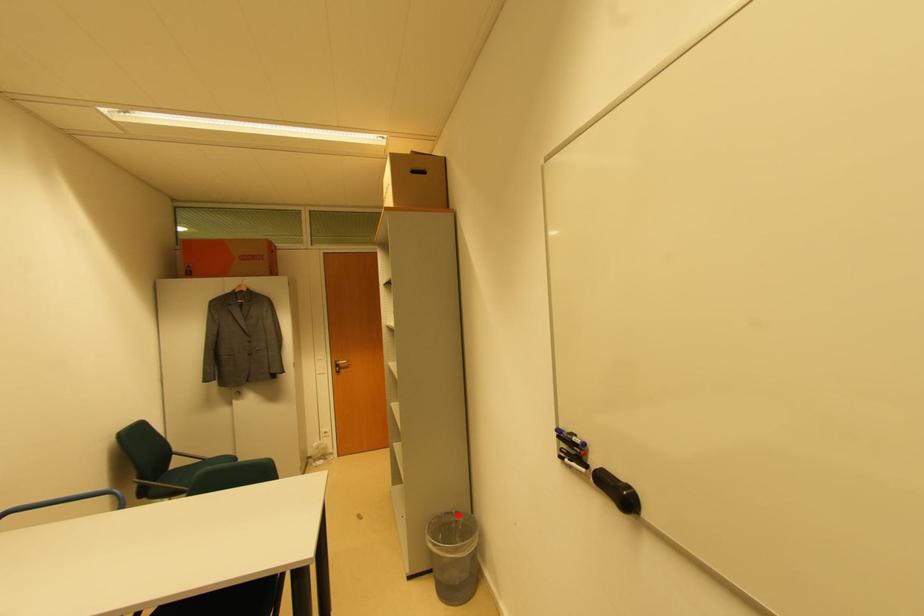
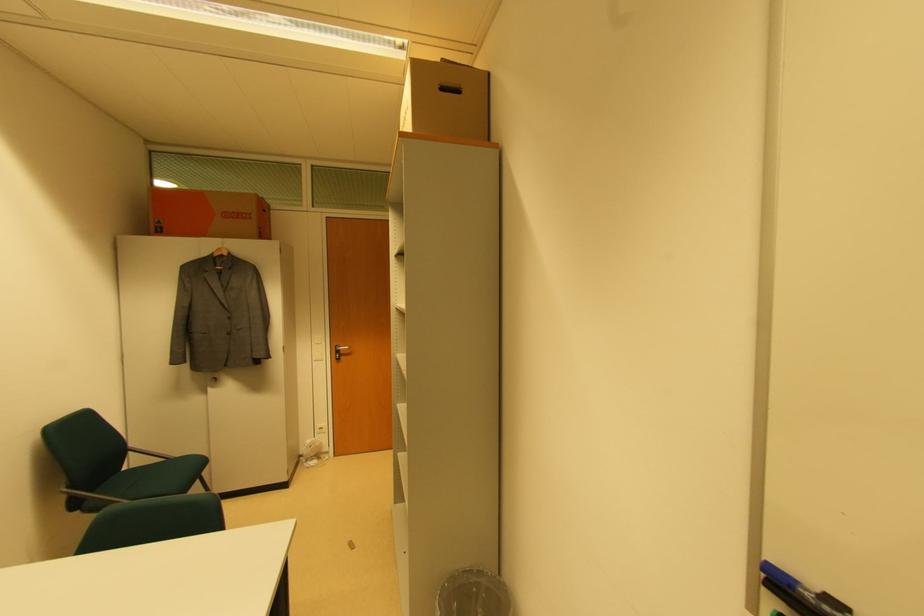
In the second image, find the point that corresponds to the highlighted location in the first image.

(480, 575)